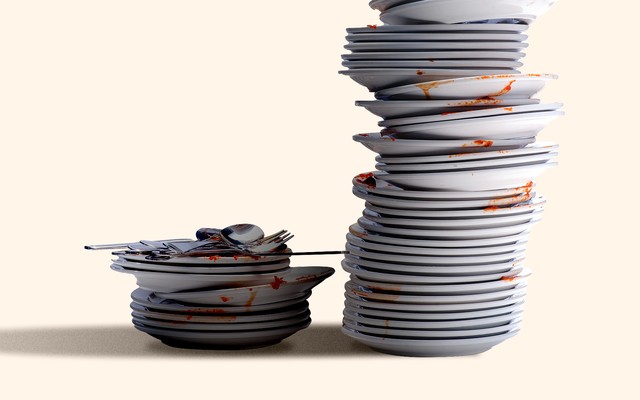
The height and width of the screenshot is (400, 640). Find the location of `plate in left pile`. plate in left pile is located at coordinates (223, 336), (205, 327), (207, 319), (196, 310), (219, 294), (186, 278), (188, 269), (188, 262).